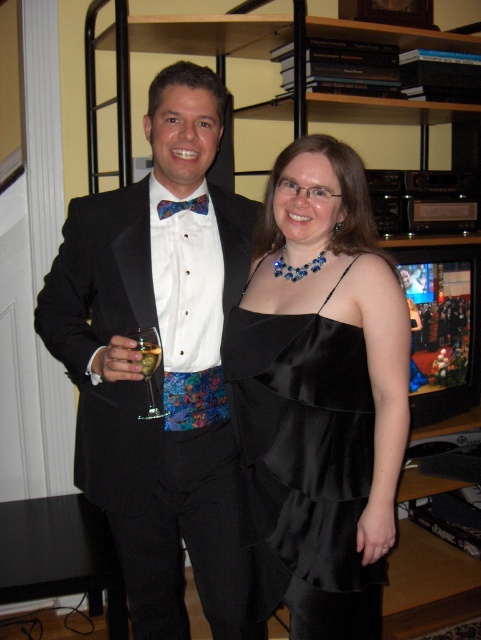
Question: Among these points, which one is nearest to the camera?

Choices:
 (A) (155, 358)
 (B) (156, 353)

Answer: (B)

Question: Can you confirm if clear glass wine glass at left is positioned below translucent glass wine at center?

Choices:
 (A) yes
 (B) no

Answer: (A)

Question: In this image, where is satin black dress at center located relative to translucent glass wine at center?

Choices:
 (A) left
 (B) right

Answer: (B)

Question: Among these points, which one is nearest to the camera?

Choices:
 (A) coord(180,202)
 (B) coord(151,483)
 (C) coord(344,488)
 (D) coord(137,332)

Answer: (D)

Question: Where is matte black tuxedo at left located in relation to satin black dress at center in the image?

Choices:
 (A) left
 (B) right

Answer: (A)

Question: Which point is farther from the camera taking this photo?

Choices:
 (A) (338, 401)
 (B) (143, 563)
 (C) (153, 355)

Answer: (B)